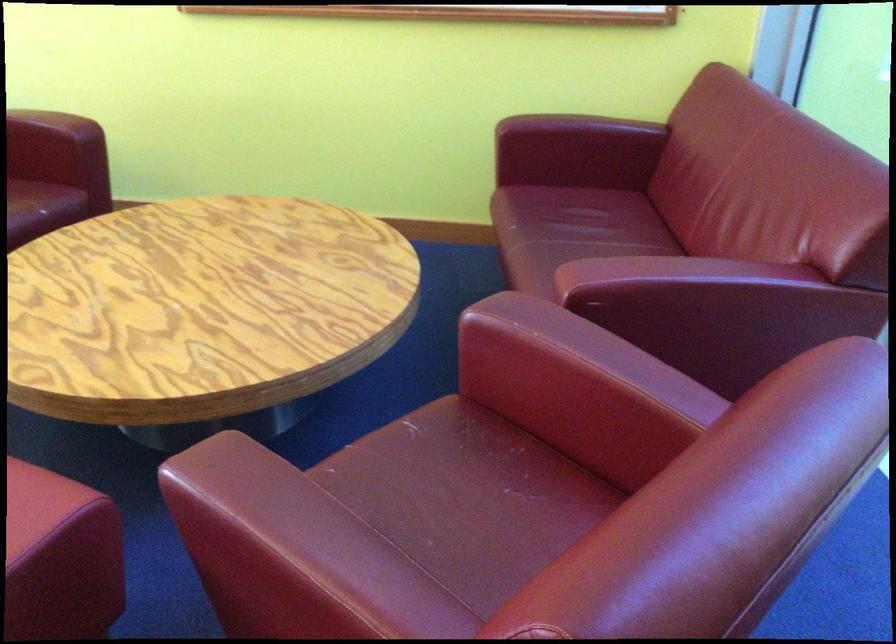
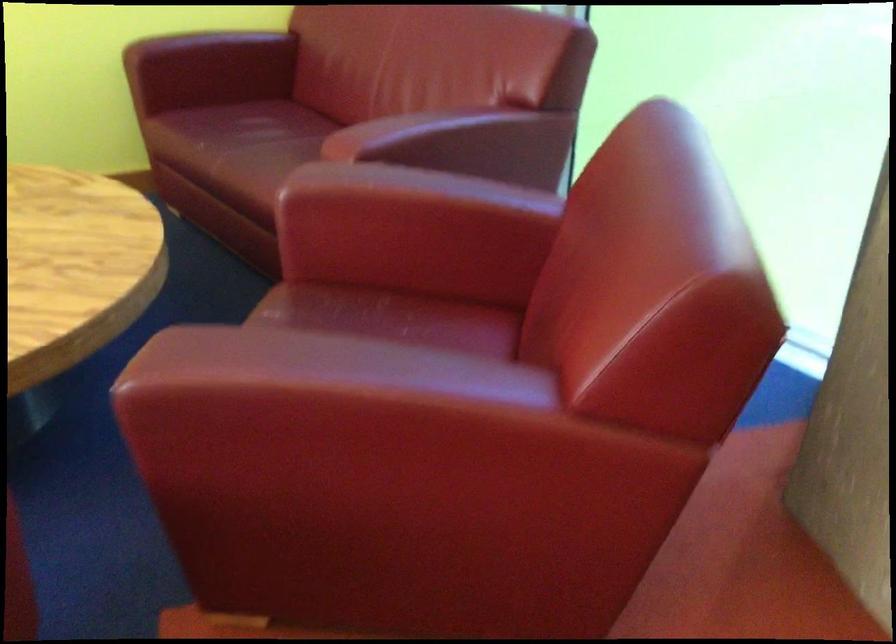
The point at (488, 465) is marked in the first image. Where is the corresponding point in the second image?

(382, 315)